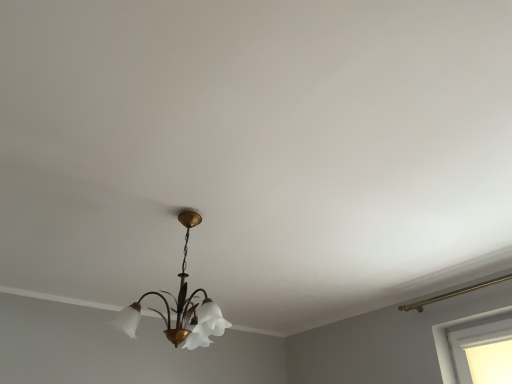
What are the coordinates of `matte gold chandelier at center` in the screenshot? It's located at (180, 306).

What do you see at coordinates (180, 306) in the screenshot?
I see `matte gold chandelier at center` at bounding box center [180, 306].

The height and width of the screenshot is (384, 512). What do you see at coordinates (490, 362) in the screenshot? I see `white matte window at lower right` at bounding box center [490, 362].

Locate an element on the screen. This screenshot has height=384, width=512. white matte window at lower right is located at coordinates (490, 362).

At what (x,y) coordinates should I click in order to perform the action: click on matte gold chandelier at center. Please return your answer as a coordinate pair (x, y). Image resolution: width=512 pixels, height=384 pixels. Looking at the image, I should click on (180, 306).

Can you confirm if white matte window at lower right is positioned to the left of matte gold chandelier at center?

In fact, white matte window at lower right is to the right of matte gold chandelier at center.

Does white matte window at lower right come in front of matte gold chandelier at center?

No, it is behind matte gold chandelier at center.

Is point (482, 349) positioned in front of point (186, 242)?

No, it is behind (186, 242).

From the image's perspective, is white matte window at lower right below matte gold chandelier at center?

Indeed, from the image's perspective, white matte window at lower right is shown beneath matte gold chandelier at center.

From a real-world perspective, who is located higher, white matte window at lower right or matte gold chandelier at center?

From a 3D spatial view, matte gold chandelier at center is above.

Does white matte window at lower right have a lesser width compared to matte gold chandelier at center?

Indeed, white matte window at lower right has a lesser width compared to matte gold chandelier at center.

Is white matte window at lower right shorter than matte gold chandelier at center?

Yes.

Looking at this image, who is bigger, white matte window at lower right or matte gold chandelier at center?

matte gold chandelier at center.

Is matte gold chandelier at center completely or partially inside white matte window at lower right?

That's incorrect, matte gold chandelier at center is not inside white matte window at lower right.

Are white matte window at lower right and matte gold chandelier at center far apart?

Absolutely, white matte window at lower right is distant from matte gold chandelier at center.

Is white matte window at lower right oriented towards matte gold chandelier at center?

Yes, white matte window at lower right is turned towards matte gold chandelier at center.

Identify the location of lamp on the left of white matte window at lower right. The image size is (512, 384). (180, 306).

Which object is positioned more to the right, matte gold chandelier at center or white matte window at lower right?

white matte window at lower right is more to the right.

Is matte gold chandelier at center closer to camera compared to white matte window at lower right?

Yes, it is.

Which is farther from the camera, [218,307] or [495,383]?

The point [218,307] is farther from the camera.

From the image's perspective, is matte gold chandelier at center positioned above or below white matte window at lower right?

matte gold chandelier at center is situated higher than white matte window at lower right in the image.

From a real-world perspective, between matte gold chandelier at center and white matte window at lower right, who is vertically lower?

white matte window at lower right, from a real-world perspective.

Can you confirm if matte gold chandelier at center is wider than white matte window at lower right?

Yes.

Considering the sizes of objects matte gold chandelier at center and white matte window at lower right in the image provided, who is shorter, matte gold chandelier at center or white matte window at lower right?

With less height is white matte window at lower right.

Which of these two, matte gold chandelier at center or white matte window at lower right, is smaller?

Smaller between the two is white matte window at lower right.

Is white matte window at lower right inside matte gold chandelier at center?

That's incorrect, white matte window at lower right is not inside matte gold chandelier at center.

Are matte gold chandelier at center and white matte window at lower right making contact?

matte gold chandelier at center and white matte window at lower right are not in contact.

Is matte gold chandelier at center oriented towards white matte window at lower right?

No, matte gold chandelier at center is not facing towards white matte window at lower right.

Can you tell me how much matte gold chandelier at center and white matte window at lower right differ in facing direction?

There is a 89.3-degree angle between the facing directions of matte gold chandelier at center and white matte window at lower right.

Locate an element on the screen. The image size is (512, 384). lamp lying above the white matte window at lower right (from the image's perspective) is located at coordinates point(180,306).

Where is `window that is under the matte gold chandelier at center (from a real-world perspective)`? window that is under the matte gold chandelier at center (from a real-world perspective) is located at coordinates (490, 362).

The height and width of the screenshot is (384, 512). I want to click on window located below the matte gold chandelier at center (from the image's perspective), so click(x=490, y=362).